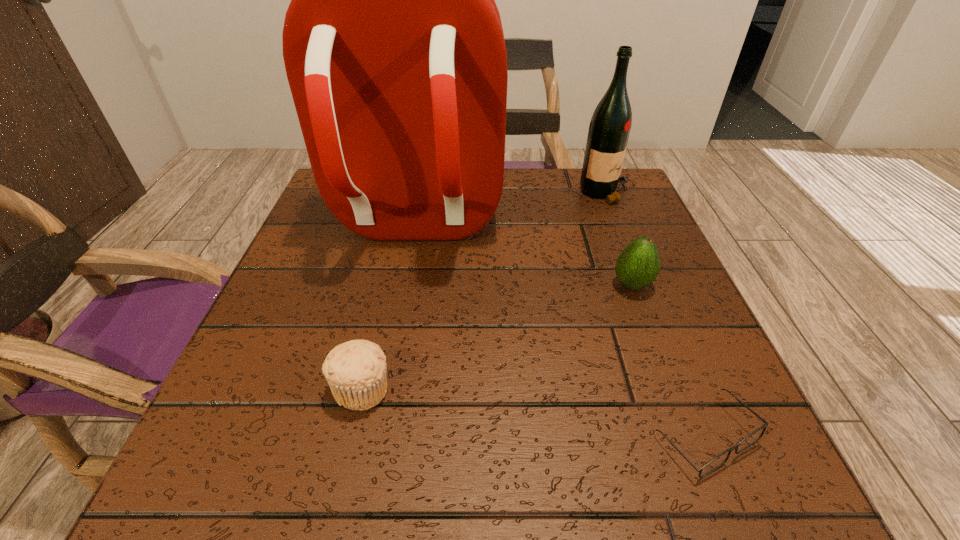
At what (x,y) coordinates should I click in order to perform the action: click on vacant space at the far edge of the desktop. Please return your answer as a coordinate pair (x, y). Image resolution: width=960 pixels, height=540 pixels. Looking at the image, I should click on (497, 220).

This screenshot has height=540, width=960. In the image, there is a desktop. Identify the location of vacant area at the near edge. (373, 492).

Locate an element on the screen. This screenshot has width=960, height=540. vacant space at the left edge is located at coordinates (353, 312).

Image resolution: width=960 pixels, height=540 pixels. Identify the location of vacant space at the right edge of the desktop. (727, 420).

Locate an element on the screen. The image size is (960, 540). vacant space at the near left corner is located at coordinates (244, 479).

Identify the location of vacant area at the far right corner. (640, 221).

Where is `free space that is in between the shortest object and the third shortest object`? free space that is in between the shortest object and the third shortest object is located at coordinates (x=668, y=361).

Image resolution: width=960 pixels, height=540 pixels. What are the coordinates of `free space between the spectacles and the tallest object` in the screenshot? It's located at (560, 331).

The width and height of the screenshot is (960, 540). Identify the location of vacant region between the muffin and the spectacles. (533, 413).

Locate an element on the screen. The height and width of the screenshot is (540, 960). free space between the shortest object and the wine bottle is located at coordinates (656, 315).